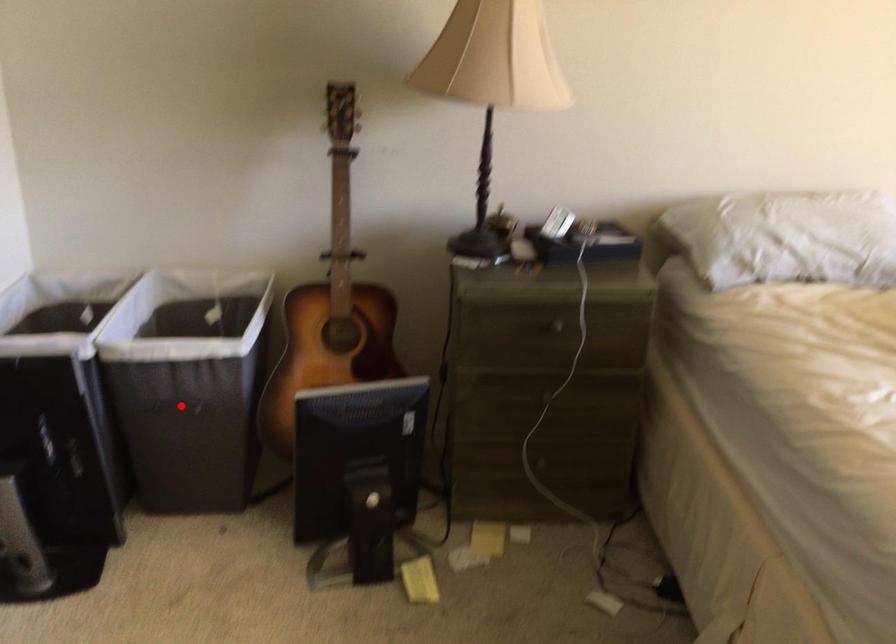
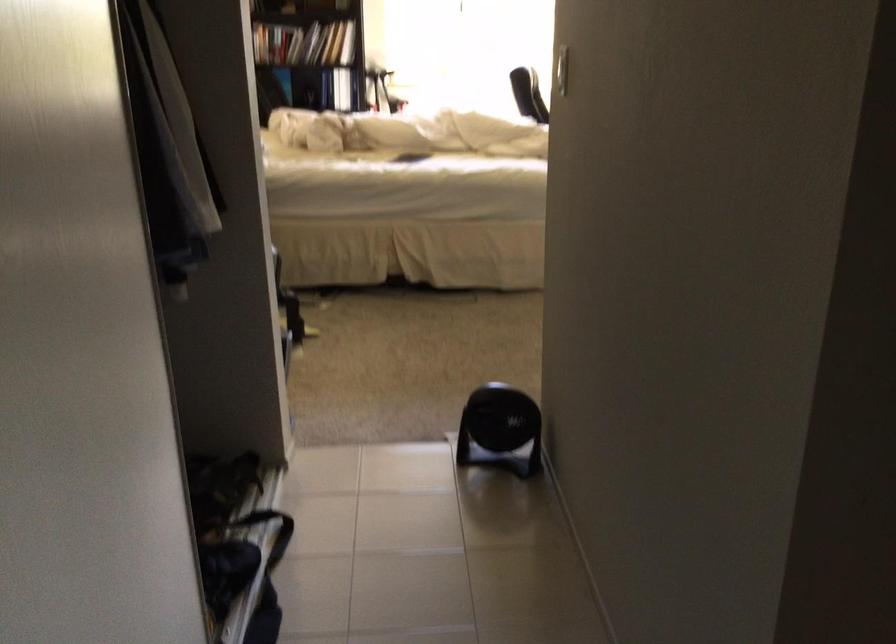
Question: I am providing you with two images of the same scene from different viewpoints. A red point is marked on the first image. Is the red point's position out of view in image 2?

Choices:
 (A) Yes
 (B) No

Answer: (A)